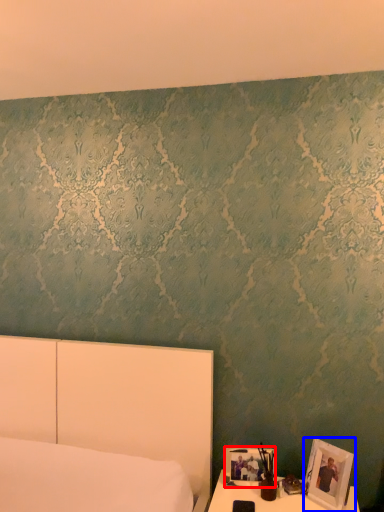
Question: Which point is closer to the camera, picture frame (highlighted by a red box) or picture frame (highlighted by a blue box)?

Choices:
 (A) picture frame
 (B) picture frame

Answer: (B)